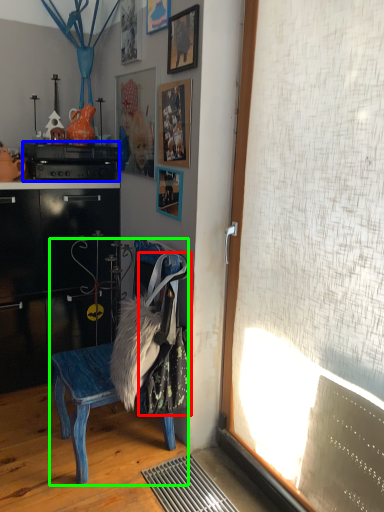
Question: Based on their relative distances, which object is farther from laundry (highlighted by a red box)? Choose from appliance (highlighted by a blue box) and chair (highlighted by a green box).

Choices:
 (A) appliance
 (B) chair

Answer: (A)